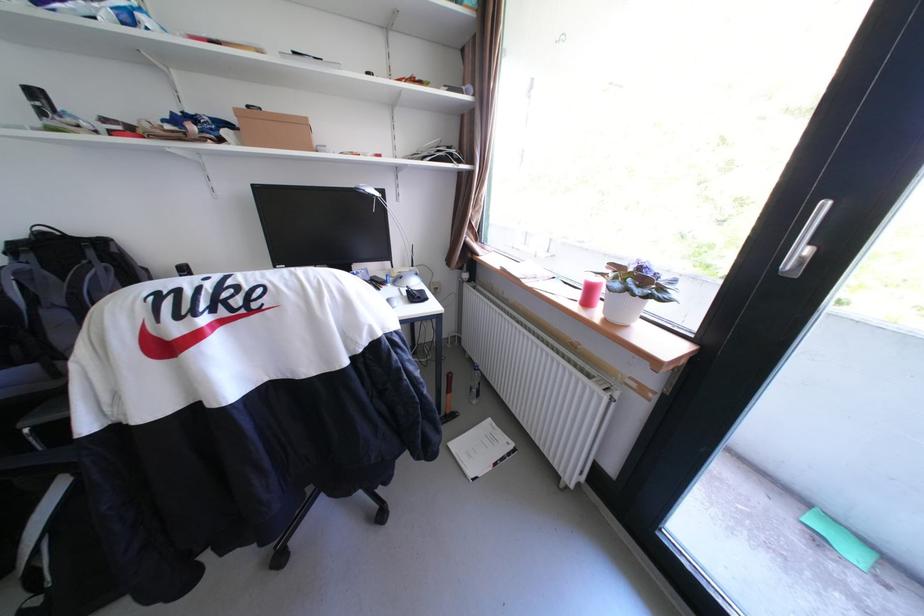
Image resolution: width=924 pixels, height=616 pixels. Describe the element at coordinates (480, 448) in the screenshot. I see `the white paper booklet` at that location.